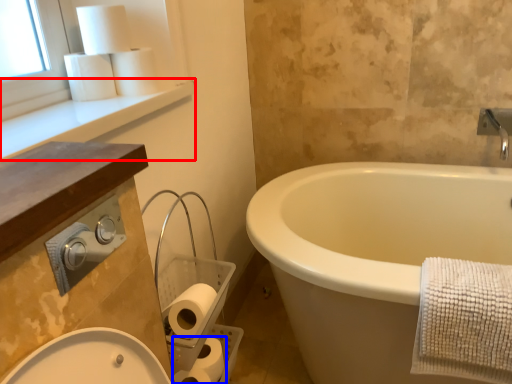
Question: Which object is further to the camera taking this photo, window sill (highlighted by a red box) or toilet paper (highlighted by a blue box)?

Choices:
 (A) window sill
 (B) toilet paper

Answer: (B)